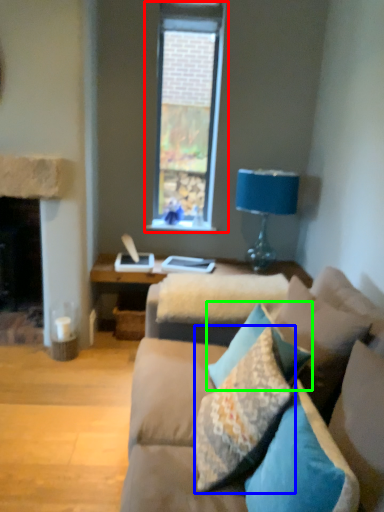
Question: Considering the real-world distances, which object is closest to window (highlighted by a red box)? pillow (highlighted by a blue box) or pillow (highlighted by a green box).

Choices:
 (A) pillow
 (B) pillow

Answer: (B)